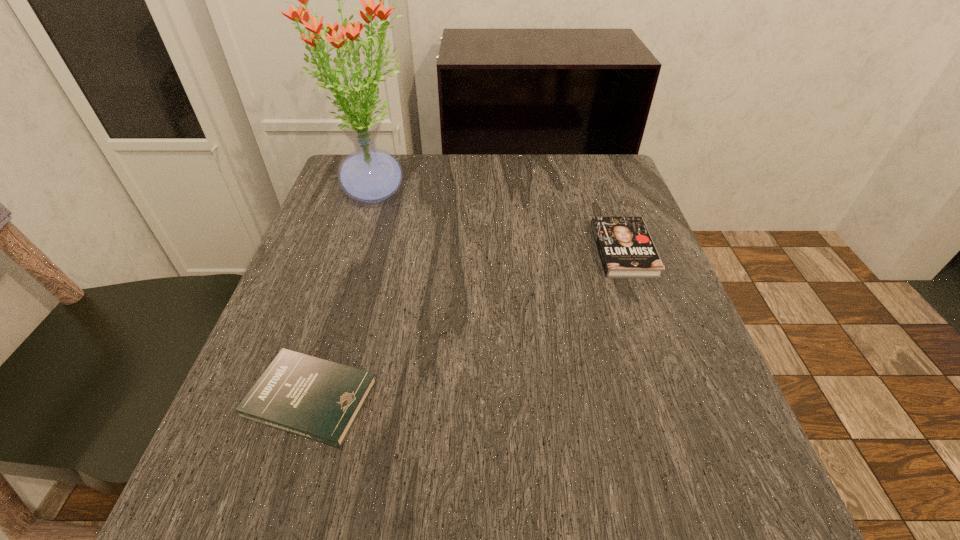
You are a GUI agent. You are given a task and a screenshot of the screen. Output one action in this format:
    pyautogui.click(x=<x>, y=<y>)
    Task: Click on the vacant area that lies between the right book and the tallest object
    
    Given the screenshot: What is the action you would take?
    pyautogui.click(x=499, y=221)

Where is `free spot between the second farthest object and the flower arrangement`? This screenshot has width=960, height=540. free spot between the second farthest object and the flower arrangement is located at coordinates (499, 221).

At what (x,y) coordinates should I click in order to perform the action: click on free space between the second nearest object and the nearer book. Please return your answer as a coordinate pair (x, y). Image resolution: width=960 pixels, height=540 pixels. Looking at the image, I should click on (468, 325).

The height and width of the screenshot is (540, 960). What are the coordinates of `free space between the second farthest object and the flower arrangement` in the screenshot? It's located at (499, 221).

The image size is (960, 540). Identify the location of vacant point located between the nearer book and the flower arrangement. (343, 295).

Find the location of a particular element. This screenshot has width=960, height=540. unoccupied position between the nearest object and the tallest object is located at coordinates (343, 295).

Find the location of a particular element. The width and height of the screenshot is (960, 540). empty space between the nearer book and the second nearest object is located at coordinates (468, 325).

Image resolution: width=960 pixels, height=540 pixels. Find the location of `empty location between the farther book and the nearest object`. empty location between the farther book and the nearest object is located at coordinates (468, 325).

At what (x,y) coordinates should I click in order to perform the action: click on empty space that is in between the left book and the tallest object. Please return your answer as a coordinate pair (x, y). Looking at the image, I should click on [x=343, y=295].

I want to click on unoccupied position between the right book and the farthest object, so click(499, 221).